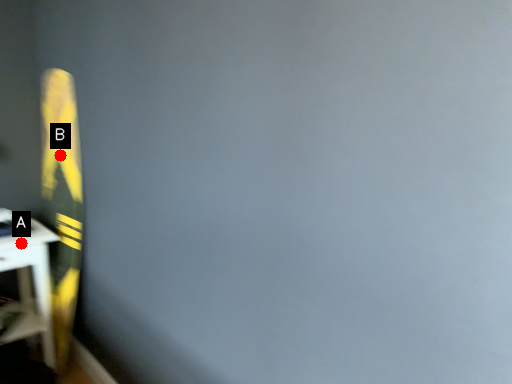
Question: Two points are circled on the image, labeled by A and B beside each circle. Among these points, which one is farthest from the camera?

Choices:
 (A) A is further
 (B) B is further

Answer: (B)